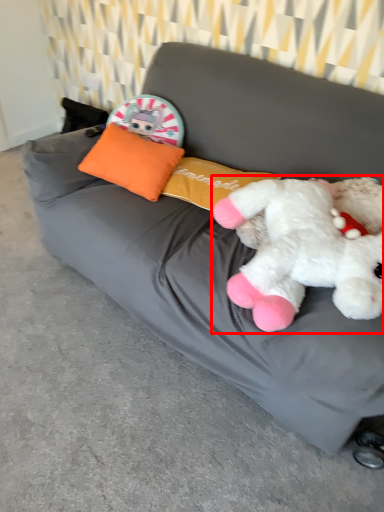
Question: Where is toy (annotated by the red box) located in relation to pillow in the image?

Choices:
 (A) right
 (B) left

Answer: (A)